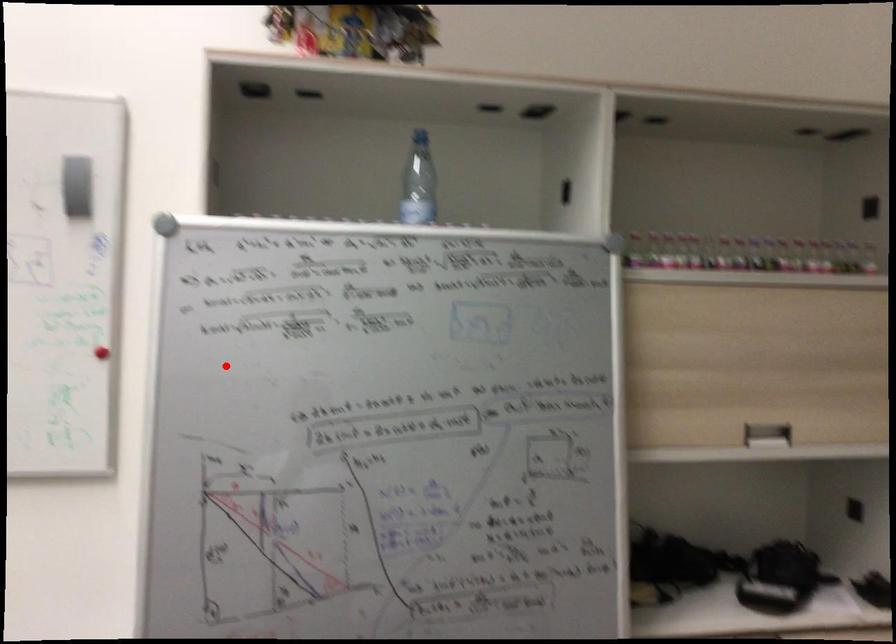
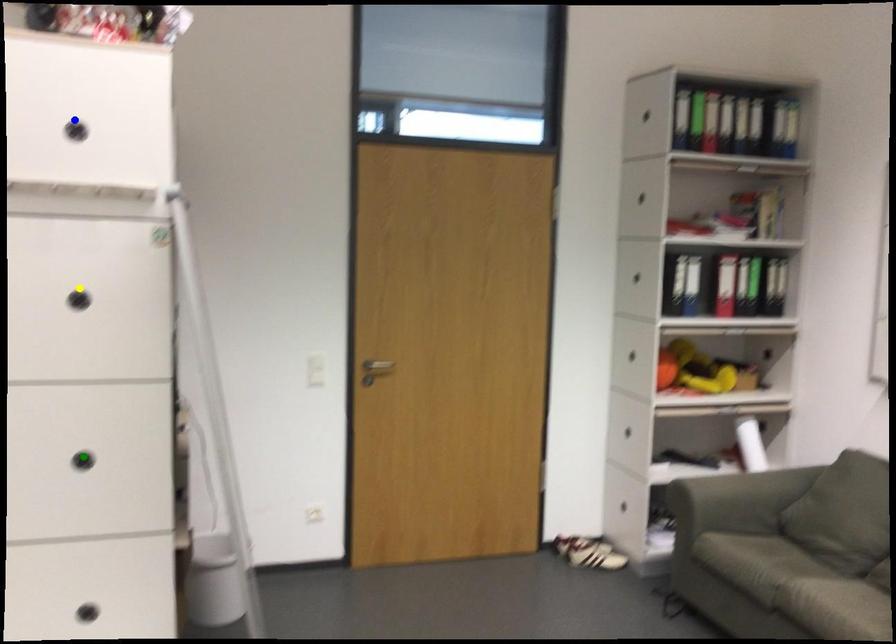
Question: I am providing you with two images of the same scene from different viewpoints. A red point is marked on the first image. You are given multiple points on the second image. In image 2, which mark is for the same physical point as the one in image 1?

Choices:
 (A) blue point
 (B) green point
 (C) yellow point

Answer: (C)